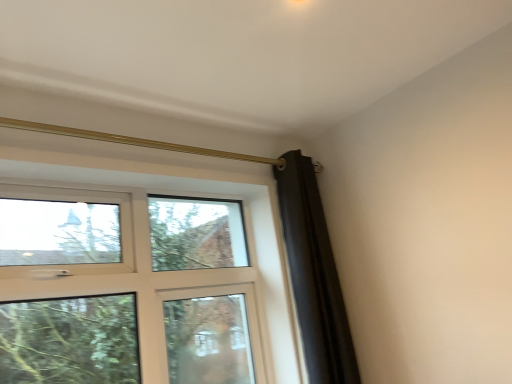
From the picture: In order to face clear glass window at upper left, should I rotate leftwards or rightwards?

A 12.647 degree turn to the left will do.

The image size is (512, 384). Describe the element at coordinates (141, 277) in the screenshot. I see `clear glass window at upper left` at that location.

Locate an element on the screen. The image size is (512, 384). clear glass window at upper left is located at coordinates (141, 277).

The image size is (512, 384). I want to click on clear glass window at upper left, so click(x=141, y=277).